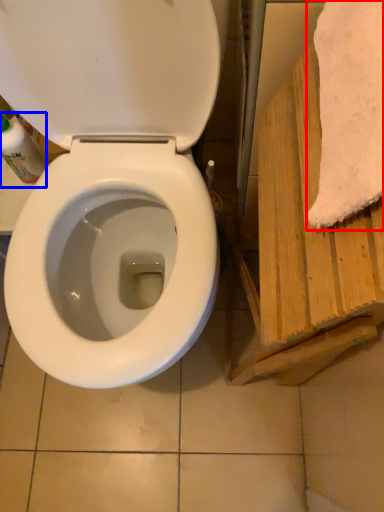
Question: Among these objects, which one is farthest to the camera, bath towel (highlighted by a red box) or cleaning product (highlighted by a blue box)?

Choices:
 (A) bath towel
 (B) cleaning product

Answer: (B)